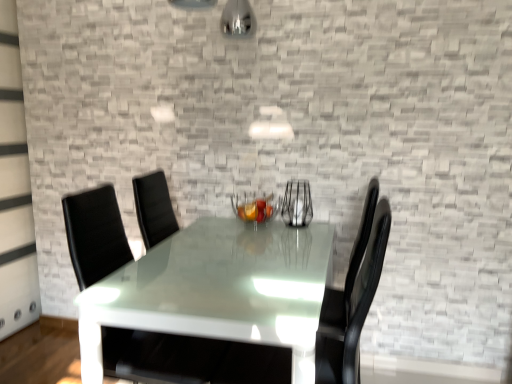
Question: Can you confirm if black leather swivel chair at center is positioned to the left of metallic wire basket at center?

Choices:
 (A) yes
 (B) no

Answer: (A)

Question: Can you confirm if black leather swivel chair at center is wider than metallic wire basket at center?

Choices:
 (A) no
 (B) yes

Answer: (B)

Question: Could you tell me if black leather swivel chair at center is facing metallic wire basket at center?

Choices:
 (A) yes
 (B) no

Answer: (B)

Question: Is black leather swivel chair at center looking in the opposite direction of metallic wire basket at center?

Choices:
 (A) yes
 (B) no

Answer: (B)

Question: Could metallic wire basket at center be considered to be inside black leather swivel chair at center?

Choices:
 (A) no
 (B) yes

Answer: (A)

Question: From the image's perspective, is black leather swivel chair at center on metallic wire basket at center?

Choices:
 (A) no
 (B) yes

Answer: (A)

Question: Is clear glass vase at center looking in the opposite direction of metallic wire basket at center?

Choices:
 (A) no
 (B) yes

Answer: (A)

Question: Considering the relative positions of clear glass vase at center and metallic wire basket at center in the image provided, is clear glass vase at center to the left of metallic wire basket at center from the viewer's perspective?

Choices:
 (A) no
 (B) yes

Answer: (A)

Question: Does clear glass vase at center have a larger size compared to metallic wire basket at center?

Choices:
 (A) no
 (B) yes

Answer: (A)

Question: From the image's perspective, does clear glass vase at center appear higher than metallic wire basket at center?

Choices:
 (A) no
 (B) yes

Answer: (B)

Question: From the image's perspective, would you say clear glass vase at center is shown under metallic wire basket at center?

Choices:
 (A) no
 (B) yes

Answer: (A)

Question: Is clear glass vase at center closer to camera compared to metallic wire basket at center?

Choices:
 (A) yes
 (B) no

Answer: (B)

Question: Considering the relative sizes of glossy white table at center and black leather swivel chair at center in the image provided, is glossy white table at center taller than black leather swivel chair at center?

Choices:
 (A) yes
 (B) no

Answer: (B)